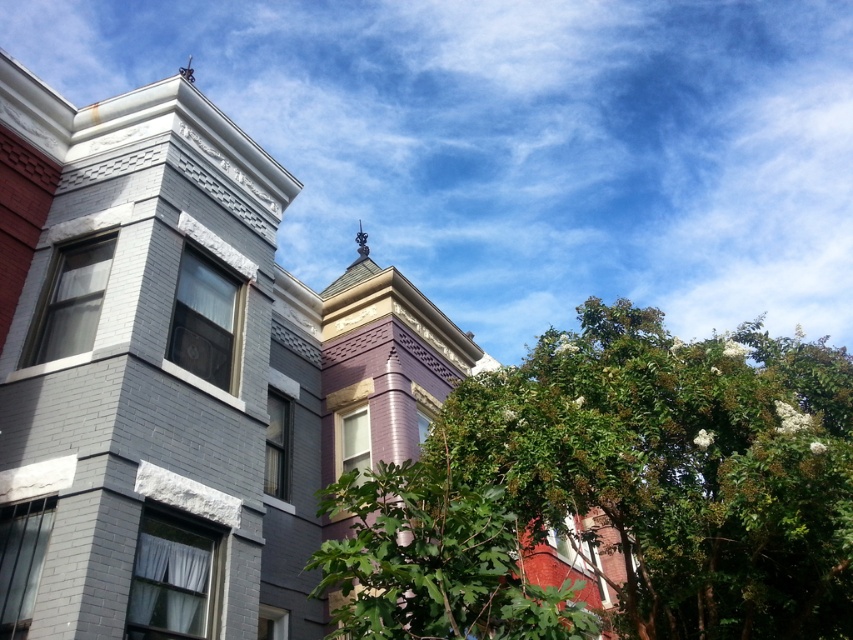
You are standing in front of the residential buildings and want to locate the green leafy tree at center. What are the coordinates where you should look?

The coordinates for the green leafy tree at center are at point (679, 467).

You are an urban planner assessing the view of the residential buildings. Which of the two green leafy trees, the green leafy tree at center or the green leafy tree at lower right, would block more of the building facade when viewed from the street?

The green leafy tree at center is much taller than the green leafy tree at lower right, so it would block more of the building facade when viewed from the street.